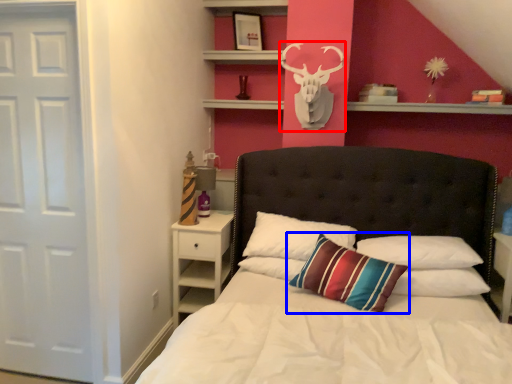
Question: Which of the following is the farthest to the observer, deer (highlighted by a red box) or pillow (highlighted by a blue box)?

Choices:
 (A) deer
 (B) pillow

Answer: (A)